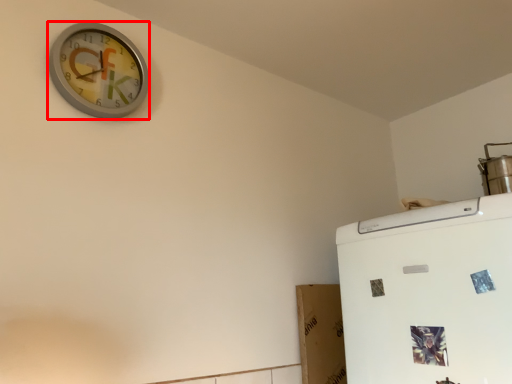
Question: From the image, what is the correct spatial relationship of wall clock (annotated by the red box) in relation to appliance?

Choices:
 (A) left
 (B) right

Answer: (A)